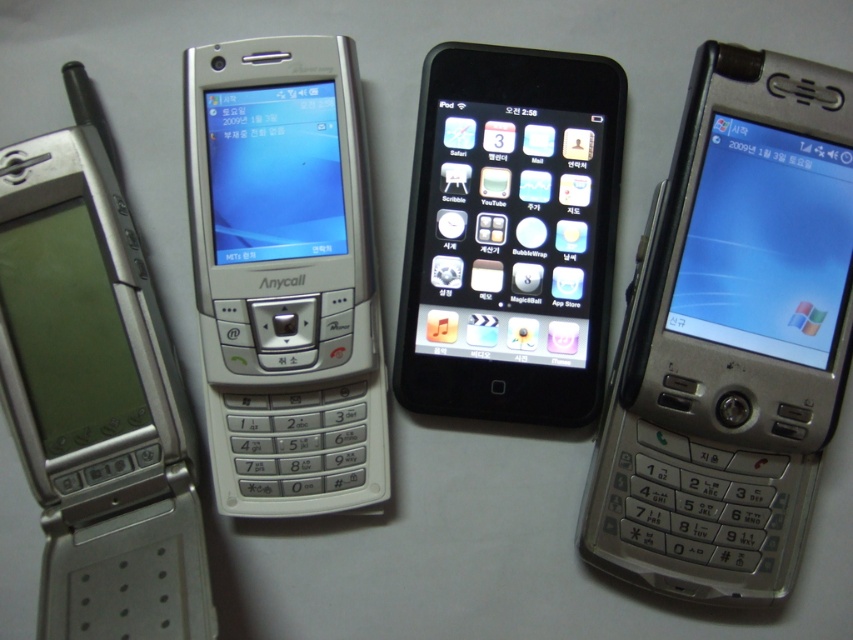
Does point (54, 216) lie behind point (424, 236)?

No, it is not.

Locate an element on the screen. The width and height of the screenshot is (853, 640). silver metallic flip phone at left is located at coordinates (96, 396).

Can you confirm if silver metallic phone at center is shorter than silver metallic flip phone at left?

Correct, silver metallic phone at center is not as tall as silver metallic flip phone at left.

The height and width of the screenshot is (640, 853). What do you see at coordinates (285, 276) in the screenshot? I see `silver metallic phone at center` at bounding box center [285, 276].

The width and height of the screenshot is (853, 640). Find the location of `silver metallic phone at center`. silver metallic phone at center is located at coordinates (285, 276).

Based on the photo, who is more forward, (271, 216) or (434, 305)?

Point (271, 216) is in front.

Image resolution: width=853 pixels, height=640 pixels. Describe the element at coordinates (285, 276) in the screenshot. I see `silver metallic phone at center` at that location.

Identify the location of silver metallic phone at center. The height and width of the screenshot is (640, 853). (285, 276).